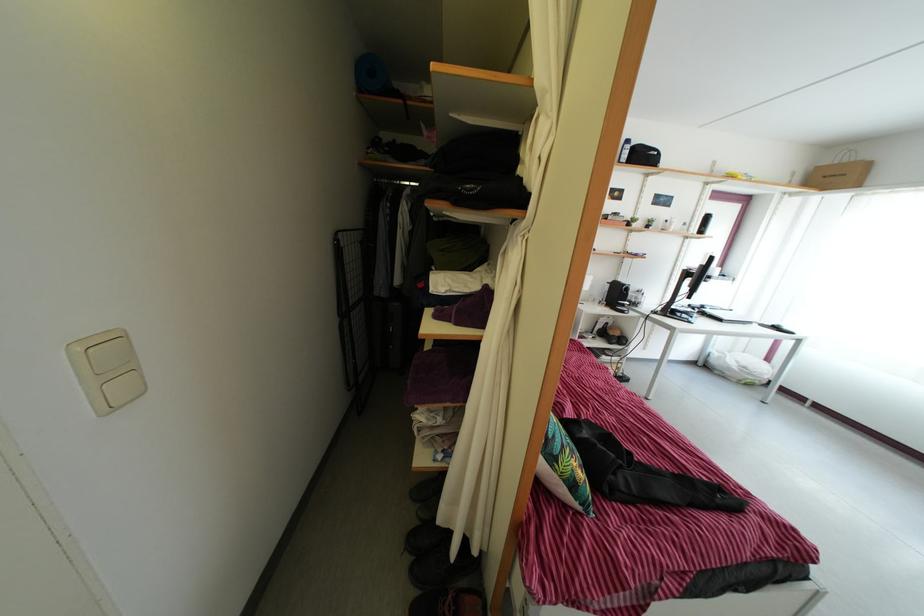
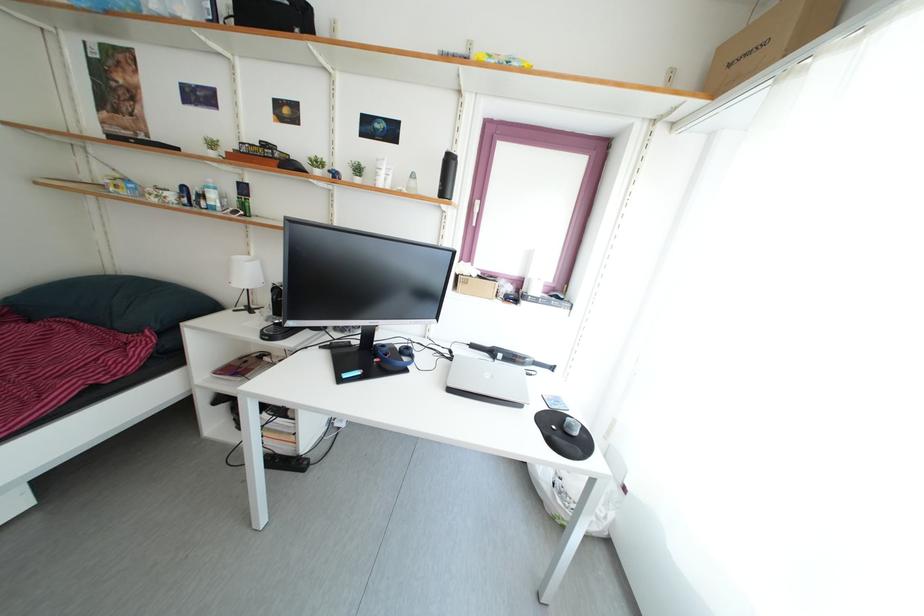
In a continuous first-person perspective shot, in which direction is the camera moving?

The cameraman moved toward right, forward.